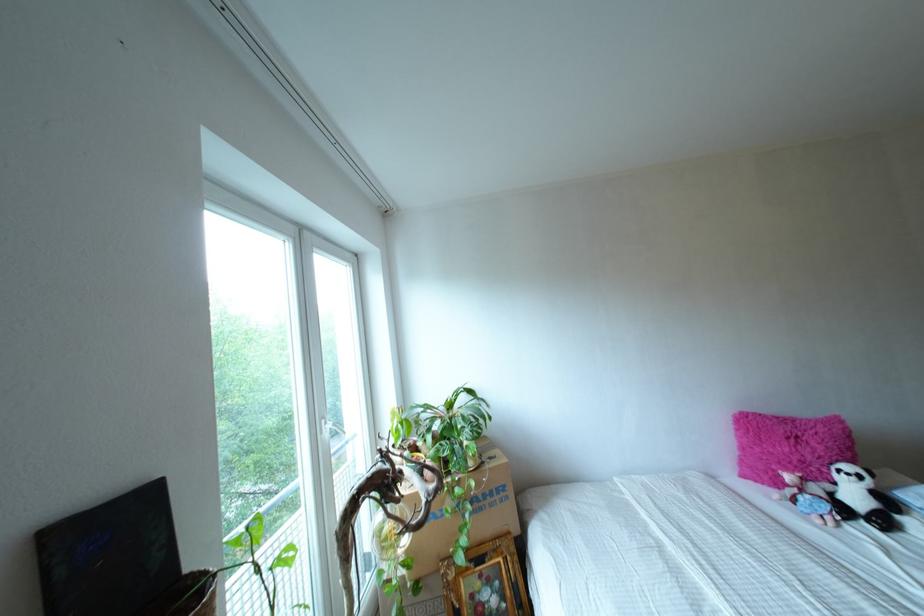
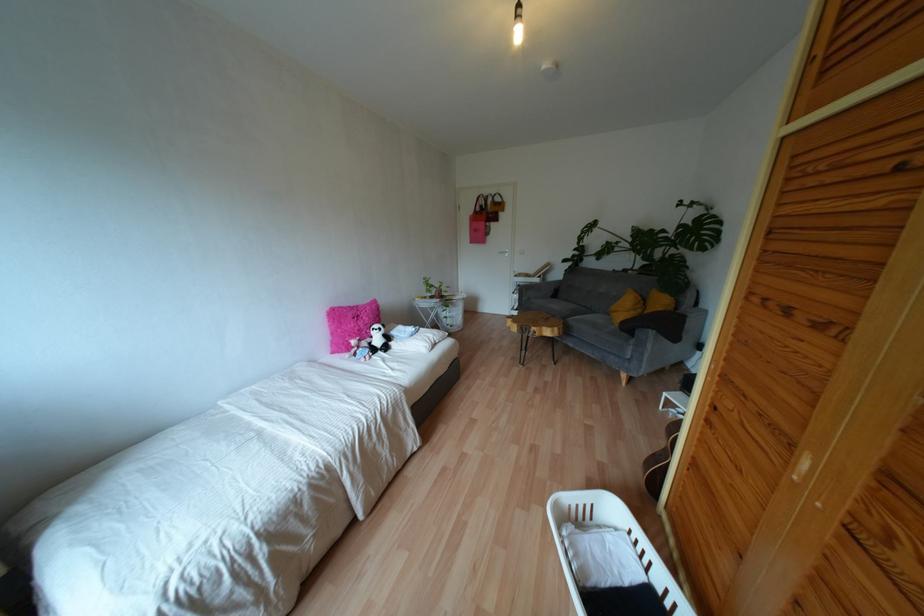
Find the pixel in the second image that matches (862,523) in the first image.

(379, 352)